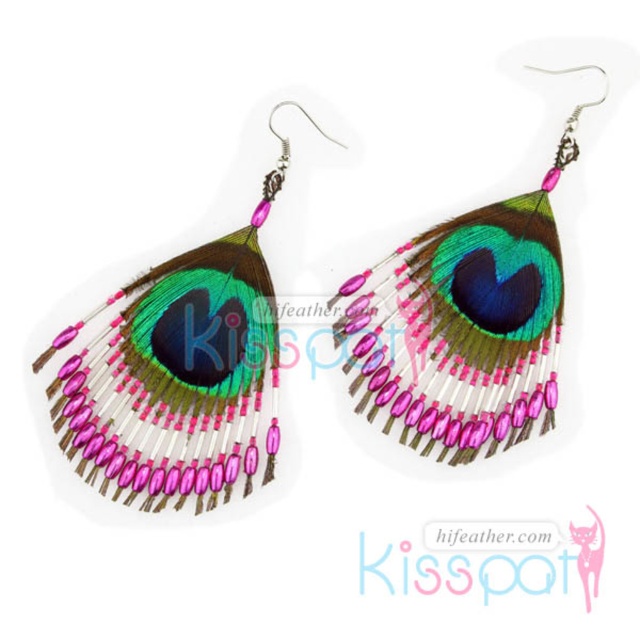
Does multicolored feather earrings at left have a lesser width compared to multicolored feather earrings at center?

In fact, multicolored feather earrings at left might be wider than multicolored feather earrings at center.

The image size is (640, 640). Describe the element at coordinates (179, 371) in the screenshot. I see `multicolored feather earrings at left` at that location.

Does point (266, 339) lie behind point (435, 304)?

No, (266, 339) is closer to viewer.

The image size is (640, 640). Identify the location of multicolored feather earrings at left. (179, 371).